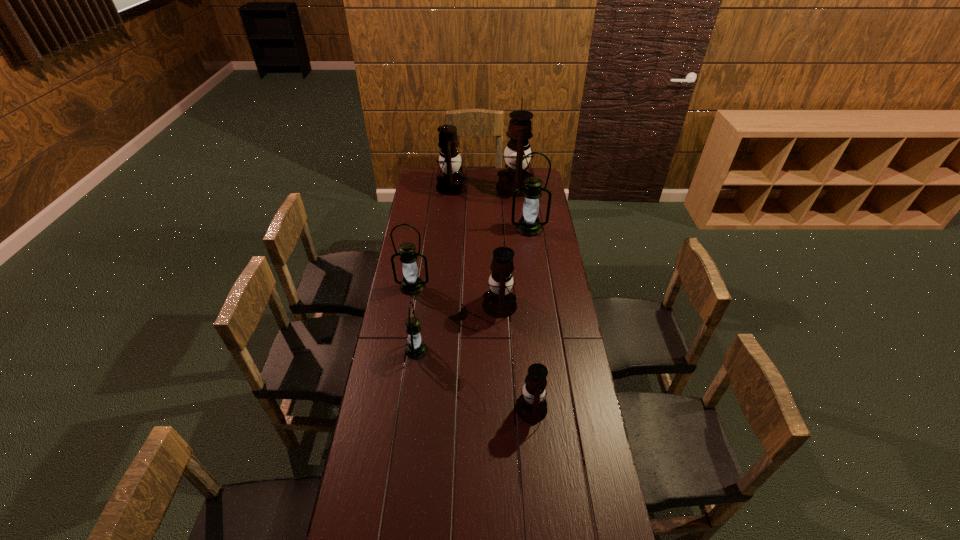
You are a GUI agent. You are given a task and a screenshot of the screen. Output one action in this format:
    pyautogui.click(x=<x>, y=<y>)
    Task: Click on the second nearest lantern
    This screenshot has height=540, width=960.
    Given the screenshot: What is the action you would take?
    [416, 349]

This screenshot has height=540, width=960. What are the coordinates of `free space located 0.230m on the side of the biggest brown lantern, there is a wick adjustment knob` in the screenshot? It's located at (458, 187).

The height and width of the screenshot is (540, 960). In order to click on vacant space situated on the side of the biggest brown lantern, there is a wick adjustment knob in this screenshot , I will do `click(474, 187)`.

Identify the location of free region located on the side of the biggest brown lantern, there is a wick adjustment knob. (481, 187).

Where is `vacant space located 0.060m on the side of the third smallest brown lantern, there is a wick adjustment knob`? This screenshot has height=540, width=960. vacant space located 0.060m on the side of the third smallest brown lantern, there is a wick adjustment knob is located at coordinates (478, 187).

This screenshot has width=960, height=540. I want to click on free region located on the side where the biggest green lantern emits light, so click(x=535, y=273).

In order to click on vacant region located 0.360m on the side of the second nearest brown lantern, there is a wick adjustment knob in this screenshot , I will do `click(401, 305)`.

Image resolution: width=960 pixels, height=540 pixels. In order to click on vacant space located 0.330m on the side of the second nearest brown lantern, there is a wick adjustment knob in this screenshot , I will do `click(408, 305)`.

Find the location of a particular element. This screenshot has width=960, height=540. vacant point located 0.360m on the side of the second nearest brown lantern, there is a wick adjustment knob is located at coordinates (401, 305).

Where is `blank space located on the side where the second smallest green lantern emits light`? This screenshot has width=960, height=540. blank space located on the side where the second smallest green lantern emits light is located at coordinates (410, 303).